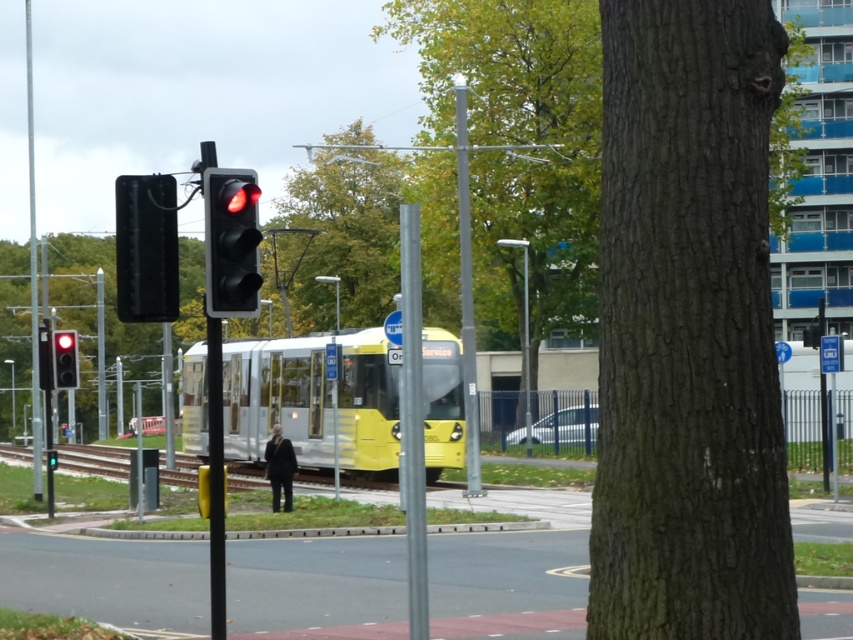
You are a pedestrian standing at the edge of the road and see the silver metallic pole at center and the matte black traffic light at center. Which object is closer to you?

The silver metallic pole at center is in front of the matte black traffic light at center, so it is closer to you.

You are a city planner analyzing this street scene. You need to determine if the yellow matte passenger train at center can be fully visible from the metallic pole at left. Based on their sizes in the image, can the entire train be seen without obstruction from the pole?

The yellow matte passenger train at center occupies less space than the metallic pole at left, meaning the pole is larger in the image. Since the pole is bigger, it might block part of the train depending on their positions. However, the description only states size comparison, not exact placement. Without knowing their exact positions, we can only confirm the size difference but cannot definitively answer visibility.

You are a city planner checking the street layout. You need to ensure that the traffic light is visible to drivers approaching the intersection. Considering the silver metallic pole at center and the matte black traffic light at center, which object might obstruct the driver view and why?

The silver metallic pole at center might obstruct the driver view because its width is larger than the matte black traffic light at center, potentially blocking the traffic light from being clearly seen.